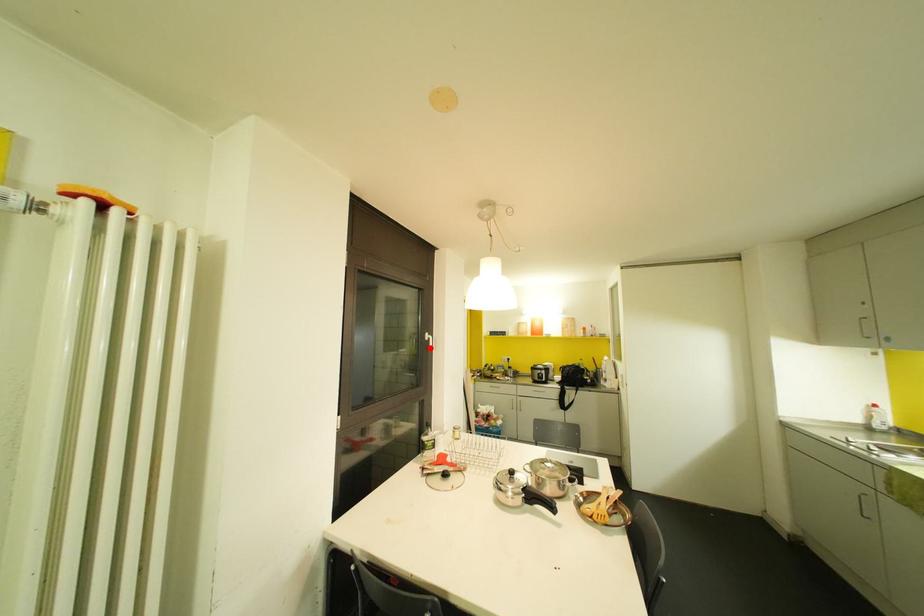
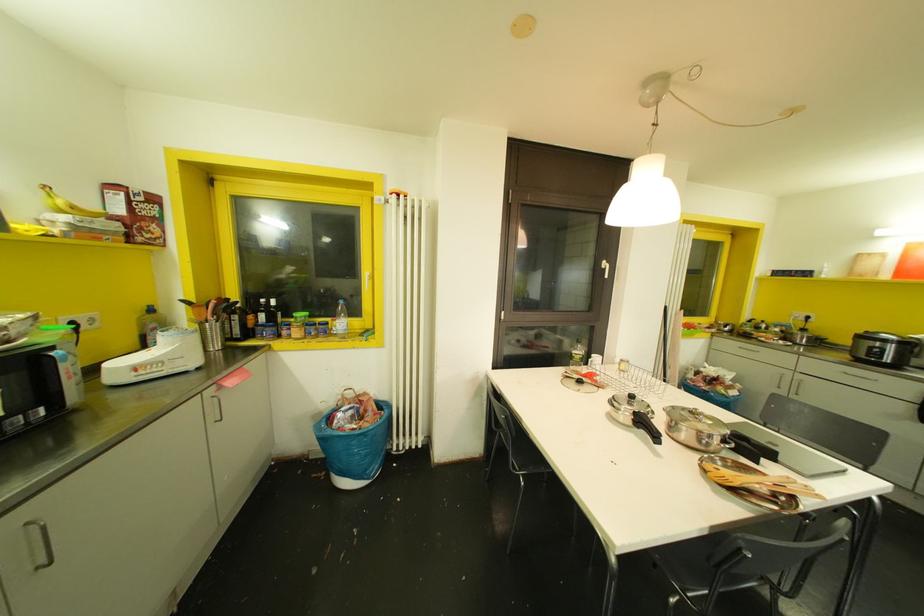
Question: I am providing you with two images of the same scene from different viewpoints. In image1, a red point is highlighted. Considering the same 3D point in image2, which of the following is correct?

Choices:
 (A) It is closer
 (B) It is farther

Answer: (A)